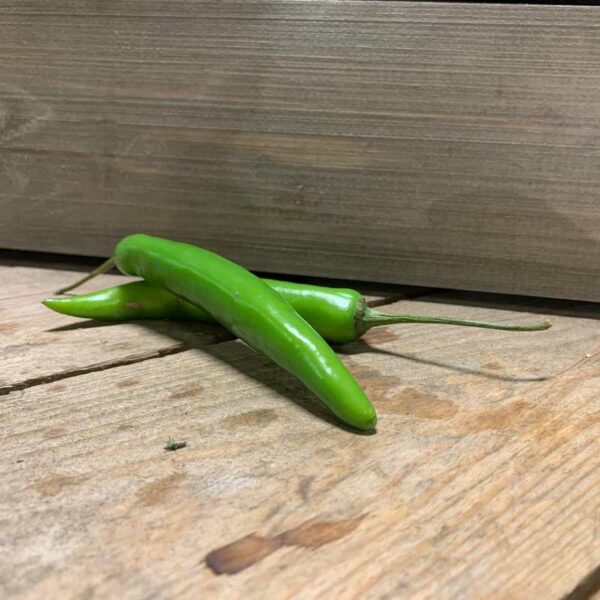
Locate an element on the screen. The width and height of the screenshot is (600, 600). light areas in wall is located at coordinates (342, 152), (293, 154), (169, 93), (150, 169).